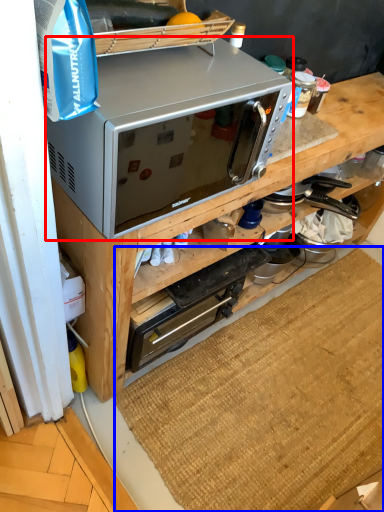
Question: Among these objects, which one is farthest to the camera, microwave oven (highlighted by a red box) or doormat (highlighted by a blue box)?

Choices:
 (A) microwave oven
 (B) doormat

Answer: (B)